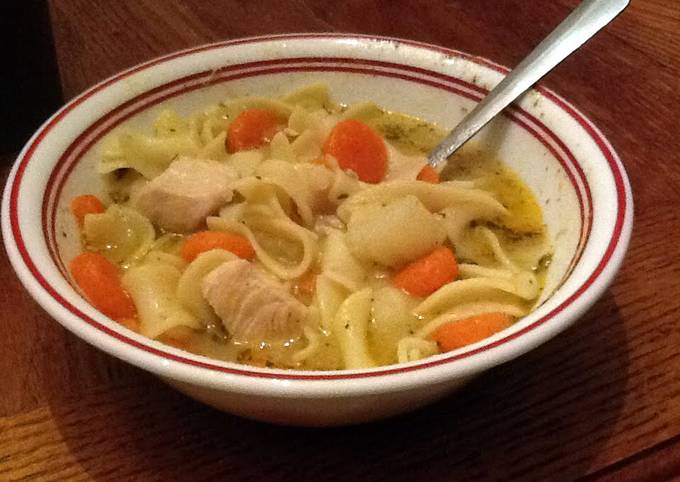
Where is `brown table top`? brown table top is located at coordinates (653, 206), (659, 286).